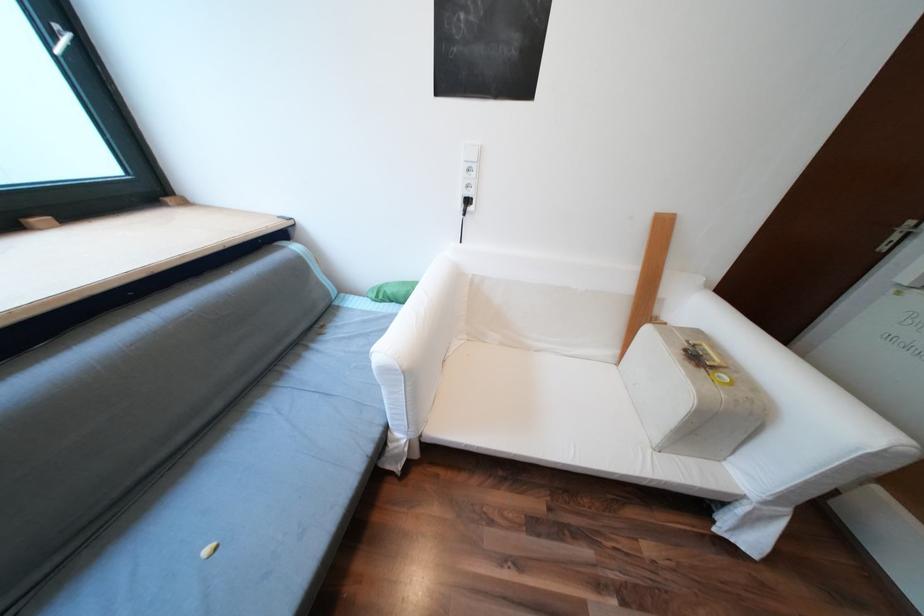
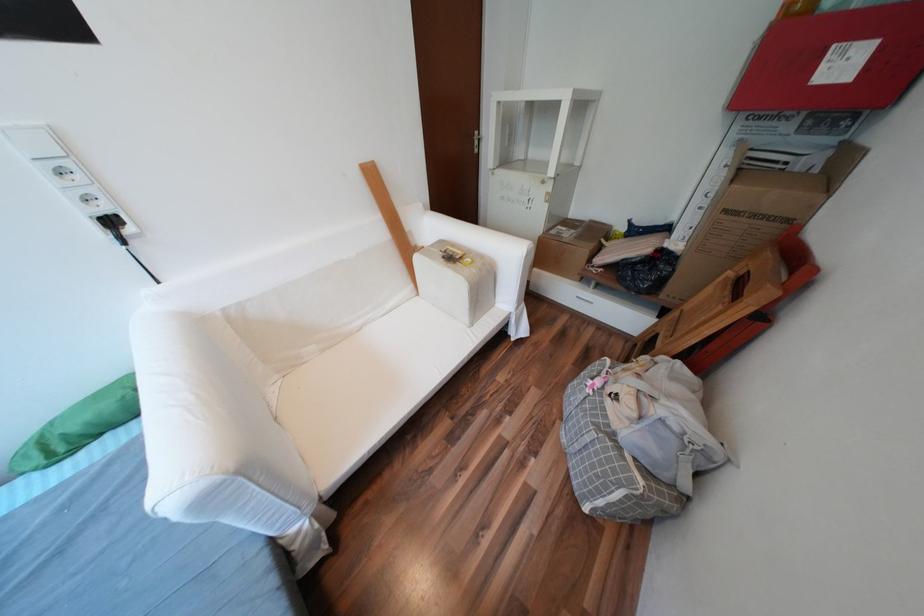
Find the pixel in the second image that matches [459,351] in the first image.

(283, 403)